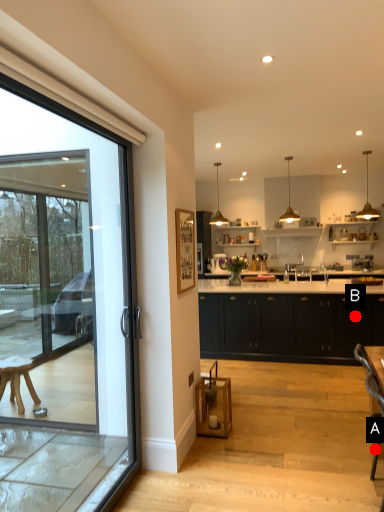
Question: Two points are circled on the image, labeled by A and B beside each circle. Which point is farther to the camera?

Choices:
 (A) A is further
 (B) B is further

Answer: (B)